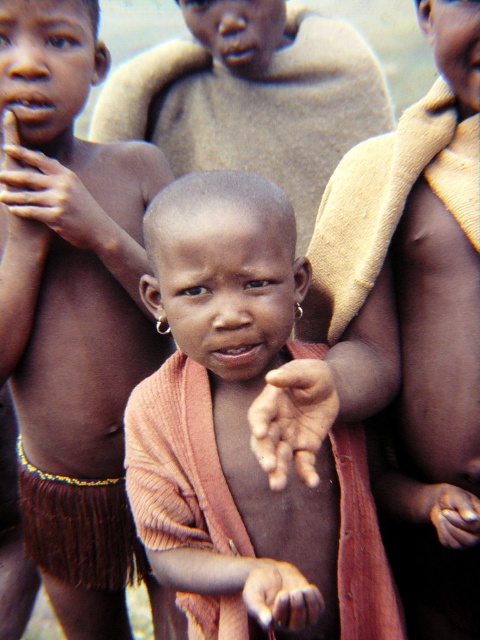
Based on the scene description, where is the matte orange cloth at center located in the image? Please provide coordinates in the format of point followed by numbers. The scene is a group of children outdoors in a rural setting.

The matte orange cloth at center is located at point (240, 422).

You are a photographer trying to capture a candid shot of the children in the scene. You need to ensure that the matte orange cloth at center and the brown skin hand at left are both in focus. Given that your camera has a depth of field that can cover objects within 20 inches of each other, will you be able to achieve this?

The matte orange cloth at center is 21.03 inches from the brown skin hand at left. Since the distance exceeds the camera lens depth of field coverage of 20 inches, the two objects cannot both be in focus simultaneously.